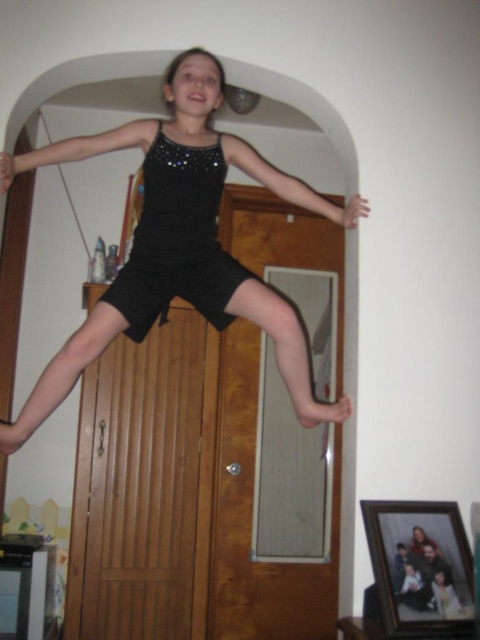
Question: Is black matte shorts at center further to camera compared to black satin dress at center?

Choices:
 (A) no
 (B) yes

Answer: (A)

Question: Does black matte shorts at center have a larger size compared to black satin dress at center?

Choices:
 (A) yes
 (B) no

Answer: (A)

Question: Which of the following is the closest to the observer?

Choices:
 (A) black matte shorts at center
 (B) black satin dress at center

Answer: (A)

Question: Is black matte shorts at center wider than black satin dress at center?

Choices:
 (A) yes
 (B) no

Answer: (A)

Question: Which point appears farthest from the camera in this image?

Choices:
 (A) (211, 189)
 (B) (259, 156)

Answer: (B)